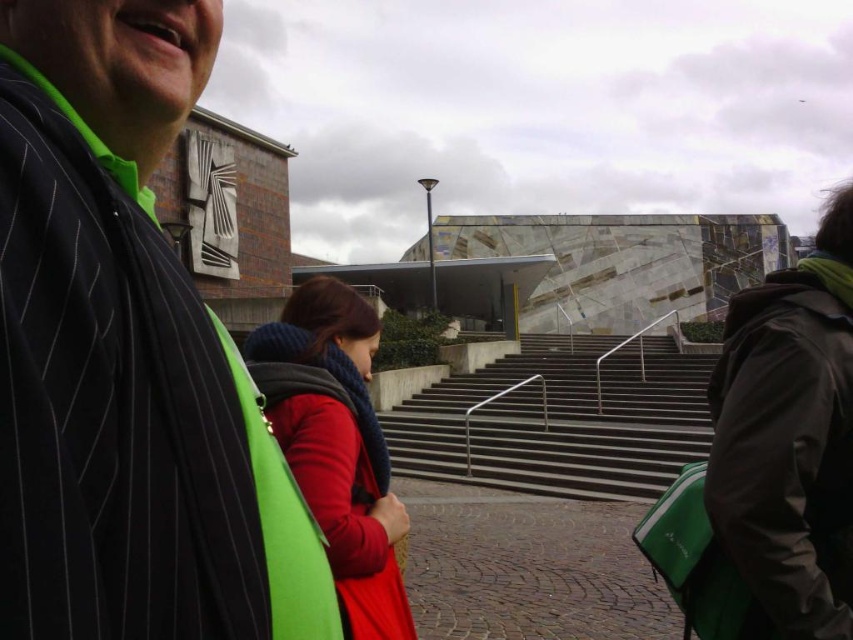
You are standing in the scene and want to walk up the slate gray concrete stairs at center. However, you notice the red wool scarf at center is hanging down. Will the scarf interfere with your ascent?

The red wool scarf at center is longer than the slate gray concrete stairs at center, so the scarf may drape over the stairs and interfere with your ascent.

You are a photographer trying to capture a group photo of the striped fabric jacket at upper left and the dark gray matte jacket at right. The camera you are using has a maximum focus range of 50 feet. Will both jackets be in focus?

The striped fabric jacket at upper left is 51.42 feet away from the dark gray matte jacket at right. Since the distance between them exceeds the camera maximum focus range of 50 feet, the camera cannot focus on both jackets simultaneously.

You are organizing a clothing donation drive and need to categorize items based on size. You have two items to sort today. The first is a dark gray matte jacket at right and the second is a red wool scarf at center. Which item is larger?

The red wool scarf at center is larger than the dark gray matte jacket at right.